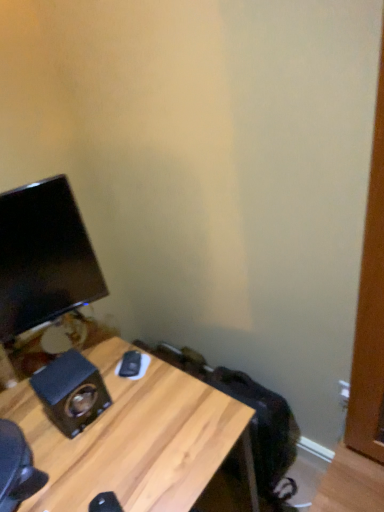
Identify the location of vacant area that is situated to the right of wooden grain speaker at lower left. (139, 408).